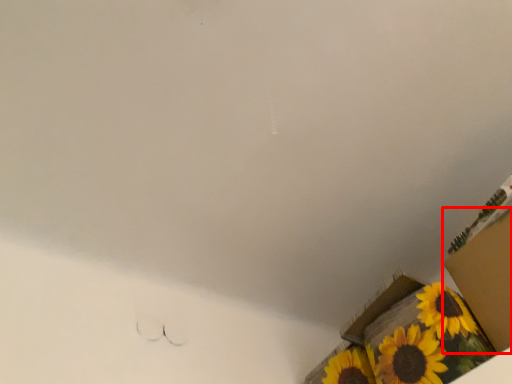
Question: From the image's perspective, what is the correct spatial positioning of cardboard box (annotated by the red box) in reference to cardboard box?

Choices:
 (A) below
 (B) above

Answer: (B)